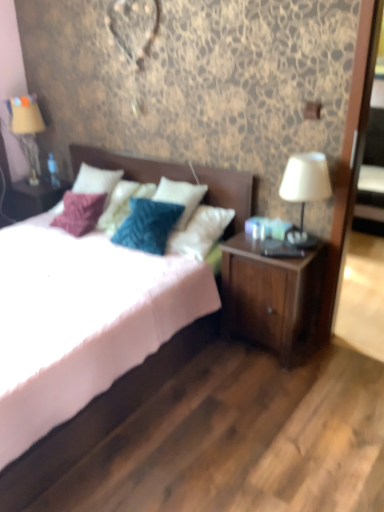
What do you see at coordinates (27, 128) in the screenshot? I see `matte beige fabric at left, the 2th table lamp from the right` at bounding box center [27, 128].

The image size is (384, 512). What do you see at coordinates (272, 297) in the screenshot?
I see `wooden nightstand at lower right` at bounding box center [272, 297].

What is the approximate width of white matte bed at center?

white matte bed at center is 1.74 meters wide.

Identify the location of matte beige fabric at left, which is counted as the 2th table lamp, starting from the front. This screenshot has width=384, height=512. (27, 128).

Is point (138, 168) less distant than point (279, 263)?

That is False.

Is white matte bed at center aimed at wooden nightstand at lower right?

No, white matte bed at center is not aimed at wooden nightstand at lower right.

From a real-world perspective, between white matte bed at center and wooden nightstand at lower right, who is vertically higher?

white matte bed at center is physically above.

Is white matte bed at center not near wooden nightstand at lower right?

No, white matte bed at center is not far from wooden nightstand at lower right.

Is matte beige fabric at left, which is the first table lamp from top to bottom, surrounded by wooden nightstand at lower right?

No.

Locate an element on the screen. Image resolution: width=384 pixels, height=512 pixels. nightstand in front of the matte beige fabric at left, placed as the second table lamp when sorted from bottom to top is located at coordinates pyautogui.click(x=272, y=297).

From a real-world perspective, is wooden nightstand at lower right on top of matte beige fabric at left, marked as the 1th table lamp in a back-to-front arrangement?

No, from a real-world perspective, wooden nightstand at lower right is not above matte beige fabric at left, marked as the 1th table lamp in a back-to-front arrangement.

From the image's perspective, is white fabric lampshade at right, which is counted as the second table lamp, starting from the back, on white matte bed at center?

Yes.

Between white fabric lampshade at right, arranged as the second table lamp when viewed from the top, and white matte bed at center, which one is positioned behind?

white fabric lampshade at right, arranged as the second table lamp when viewed from the top.

In order to click on bed on the left of white fabric lampshade at right, the 1th table lamp ordered from the bottom in this screenshot , I will do `click(100, 417)`.

Do you think matte beige fabric at left, the 2th table lamp from the right, is within white matte bed at center, or outside of it?

matte beige fabric at left, the 2th table lamp from the right, is outside white matte bed at center.

From a real-world perspective, relative to white matte bed at center, is matte beige fabric at left, which is counted as the 2th table lamp, starting from the front, vertically above or below?

Clearly, from a real-world perspective, matte beige fabric at left, which is counted as the 2th table lamp, starting from the front, is above white matte bed at center.

Can you tell me how much matte beige fabric at left, which is counted as the 2th table lamp, starting from the front, and white matte bed at center differ in facing direction?

There is a 4.42e-05-degree angle between the facing directions of matte beige fabric at left, which is counted as the 2th table lamp, starting from the front, and white matte bed at center.

Which is in front, matte beige fabric at left, the 2th table lamp from the right, or white matte bed at center?

white matte bed at center is in front.

Considering the positions of points (285, 322) and (9, 511), is point (285, 322) closer to camera compared to point (9, 511)?

No, (285, 322) is behind (9, 511).

From a real-world perspective, who is located lower, wooden nightstand at lower right or white matte bed at center?

wooden nightstand at lower right is physically lower.

Who is bigger, wooden nightstand at lower right or white matte bed at center?

Bigger between the two is white matte bed at center.

Is wooden nightstand at lower right facing away from white matte bed at center?

wooden nightstand at lower right does not have its back to white matte bed at center.

From a real-world perspective, is white fabric lampshade at right, the 1th table lamp positioned from the right, over wooden nightstand at lower right?

Correct, in the physical world, white fabric lampshade at right, the 1th table lamp positioned from the right, is higher than wooden nightstand at lower right.

Is wooden nightstand at lower right surrounded by white fabric lampshade at right, which is counted as the second table lamp, starting from the back?

Actually, wooden nightstand at lower right is outside white fabric lampshade at right, which is counted as the second table lamp, starting from the back.

Which point is more distant from viewer, (290, 181) or (224, 250)?

The point (224, 250) is farther from the camera.

From a real-world perspective, starting from the wooden nightstand at lower right, which table lamp is the 1st one vertically above it? Please provide its 2D coordinates.

[(305, 190)]

From the image's perspective, between white matte bed at center and matte beige fabric at left, which is counted as the 2th table lamp, starting from the front, which one is located above?

matte beige fabric at left, which is counted as the 2th table lamp, starting from the front.

Does white matte bed at center touch matte beige fabric at left, which is counted as the 2th table lamp, starting from the front?

No, white matte bed at center is not making contact with matte beige fabric at left, which is counted as the 2th table lamp, starting from the front.

From a real-world perspective, is white matte bed at center positioned over matte beige fabric at left, the 2th table lamp from the right, based on gravity?

No, from a real-world perspective, white matte bed at center is not over matte beige fabric at left, the 2th table lamp from the right

Where is `nightstand located below the white matte bed at center (from the image's perspective)`? Image resolution: width=384 pixels, height=512 pixels. nightstand located below the white matte bed at center (from the image's perspective) is located at coordinates (272, 297).

In order to click on the 2nd table lamp above the wooden nightstand at lower right (from the image's perspective) in this screenshot , I will do [27, 128].

Based on their spatial positions, is white fabric lampshade at right, the 1th table lamp positioned from the right, or white matte bed at center closer to matte beige fabric at left, which is the first table lamp from top to bottom?

Based on the image, white matte bed at center appears to be nearer to matte beige fabric at left, which is the first table lamp from top to bottom.

Looking at the image, which one is located closer to matte beige fabric at left, which is counted as the 2th table lamp, starting from the front, white matte bed at center or white fabric lampshade at right, which is counted as the second table lamp, starting from the back?

white matte bed at center is positioned closer to the anchor matte beige fabric at left, which is counted as the 2th table lamp, starting from the front.

Considering their positions, is matte beige fabric at left, the 2th table lamp from the right, positioned closer to wooden nightstand at lower right than white matte bed at center?

white matte bed at center lies closer to wooden nightstand at lower right than the other object.

Considering their positions, is matte beige fabric at left, placed as the second table lamp when sorted from bottom to top, positioned closer to white matte bed at center than white fabric lampshade at right, the 2th table lamp from the left?

The object closer to white matte bed at center is white fabric lampshade at right, the 2th table lamp from the left.

From the image, which object appears to be nearer to white matte bed at center, wooden nightstand at lower right or matte beige fabric at left, which is counted as the 2th table lamp, starting from the front?

The object closer to white matte bed at center is wooden nightstand at lower right.

Considering their positions, is matte beige fabric at left, the 2th table lamp from the right, positioned further to white fabric lampshade at right, which is counted as the second table lamp, starting from the back, than white matte bed at center?

matte beige fabric at left, the 2th table lamp from the right.

When comparing their distances from matte beige fabric at left, marked as the 1th table lamp in a back-to-front arrangement, does white matte bed at center or wooden nightstand at lower right seem further?

Based on the image, wooden nightstand at lower right appears to be further to matte beige fabric at left, marked as the 1th table lamp in a back-to-front arrangement.

Estimate the real-world distances between objects in this image. Which object is further from white matte bed at center, white fabric lampshade at right, the 1th table lamp ordered from the bottom, or matte beige fabric at left, placed as the second table lamp when sorted from bottom to top?

matte beige fabric at left, placed as the second table lamp when sorted from bottom to top, lies further to white matte bed at center than the other object.

I want to click on nightstand situated between matte beige fabric at left, placed as the second table lamp when sorted from bottom to top, and white fabric lampshade at right, the 1th table lamp ordered from the bottom, from left to right, so click(272, 297).

Where is `nightstand between white matte bed at center and white fabric lampshade at right, the 1th table lamp ordered from the bottom, from left to right`? Image resolution: width=384 pixels, height=512 pixels. nightstand between white matte bed at center and white fabric lampshade at right, the 1th table lamp ordered from the bottom, from left to right is located at coordinates (272, 297).

Identify the location of bed between matte beige fabric at left, marked as the 1th table lamp in a back-to-front arrangement, and white fabric lampshade at right, the 1th table lamp positioned from the right, from left to right. (100, 417).

Locate an element on the screen. nightstand between white matte bed at center and matte beige fabric at left, which is counted as the 2th table lamp, starting from the front, from front to back is located at coordinates (272, 297).